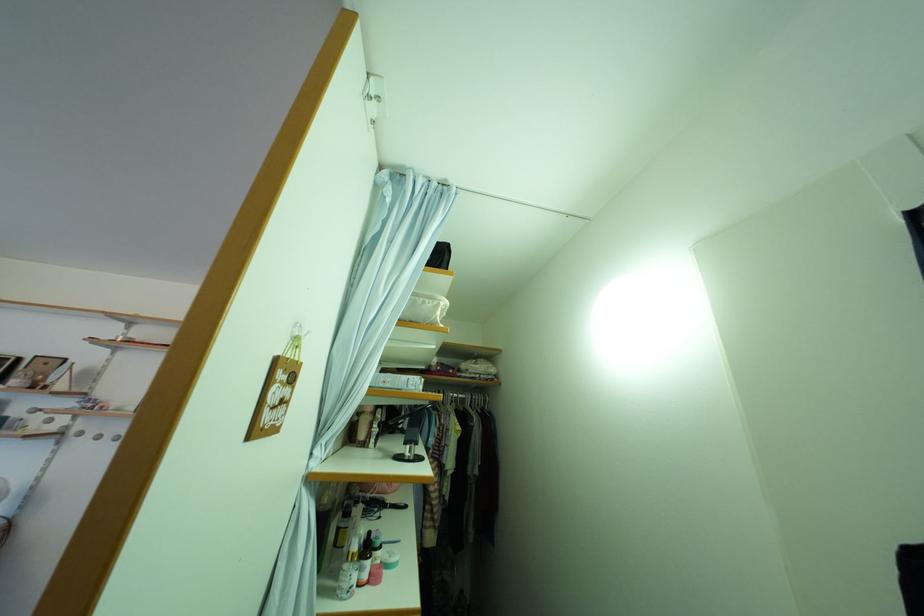
What are the coordinates of `white bottle pump` in the screenshot? It's located at (363, 424).